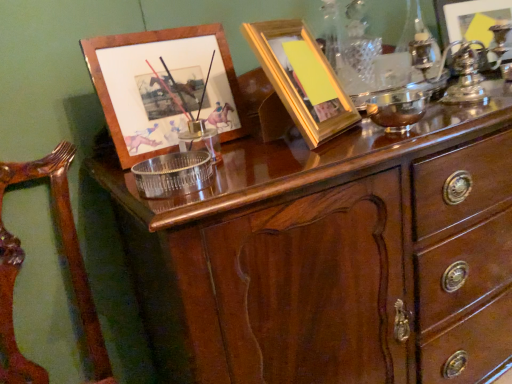
Question: Can you confirm if wooden armchair at left is shorter than yellow matte picture frame at upper center, which is counted as the second picture frame, starting from the left?

Choices:
 (A) no
 (B) yes

Answer: (A)

Question: Is the position of wooden armchair at left less distant than that of yellow matte picture frame at upper center, which is the 3th picture frame from back to front?

Choices:
 (A) yes
 (B) no

Answer: (A)

Question: Can you confirm if wooden armchair at left is wider than yellow matte picture frame at upper center, the 2th picture frame from the right?

Choices:
 (A) yes
 (B) no

Answer: (A)

Question: From the image's perspective, is wooden armchair at left under yellow matte picture frame at upper center, which is counted as the second picture frame, starting from the left?

Choices:
 (A) no
 (B) yes

Answer: (B)

Question: Considering the relative sizes of wooden armchair at left and yellow matte picture frame at upper center, the 2th picture frame from the right, in the image provided, is wooden armchair at left thinner than yellow matte picture frame at upper center, the 2th picture frame from the right,?

Choices:
 (A) yes
 (B) no

Answer: (B)

Question: From the image's perspective, is wooden armchair at left located above yellow matte picture frame at upper center, which is counted as the second picture frame, starting from the left?

Choices:
 (A) yes
 (B) no

Answer: (B)

Question: Is metallic silver picture frame at upper right, the 1th picture frame viewed from the right, closer to the viewer compared to wooden picture frame at upper left, placed as the 2th picture frame when sorted from front to back?

Choices:
 (A) yes
 (B) no

Answer: (B)

Question: From a real-world perspective, is metallic silver picture frame at upper right, positioned as the third picture frame in front-to-back order, physically above wooden picture frame at upper left, which appears as the third picture frame when viewed from the right?

Choices:
 (A) yes
 (B) no

Answer: (A)

Question: Can we say metallic silver picture frame at upper right, positioned as the third picture frame in front-to-back order, lies outside wooden picture frame at upper left, positioned as the 1th picture frame in left-to-right order?

Choices:
 (A) yes
 (B) no

Answer: (A)

Question: Can you confirm if metallic silver picture frame at upper right, which is counted as the 1th picture frame, starting from the back, is wider than wooden picture frame at upper left, which appears as the third picture frame when viewed from the right?

Choices:
 (A) no
 (B) yes

Answer: (B)

Question: Considering the relative positions of metallic silver picture frame at upper right, which is counted as the 1th picture frame, starting from the back, and wooden picture frame at upper left, positioned as the 1th picture frame in left-to-right order, in the image provided, is metallic silver picture frame at upper right, which is counted as the 1th picture frame, starting from the back, behind wooden picture frame at upper left, positioned as the 1th picture frame in left-to-right order,?

Choices:
 (A) yes
 (B) no

Answer: (A)

Question: Considering the relative sizes of metallic silver picture frame at upper right, which is counted as the 1th picture frame, starting from the back, and wooden picture frame at upper left, placed as the 2th picture frame when sorted from front to back, in the image provided, is metallic silver picture frame at upper right, which is counted as the 1th picture frame, starting from the back, taller than wooden picture frame at upper left, placed as the 2th picture frame when sorted from front to back,?

Choices:
 (A) no
 (B) yes

Answer: (A)

Question: From a real-world perspective, is wooden picture frame at upper left, positioned as the 1th picture frame in left-to-right order, beneath wooden armchair at left?

Choices:
 (A) no
 (B) yes

Answer: (A)